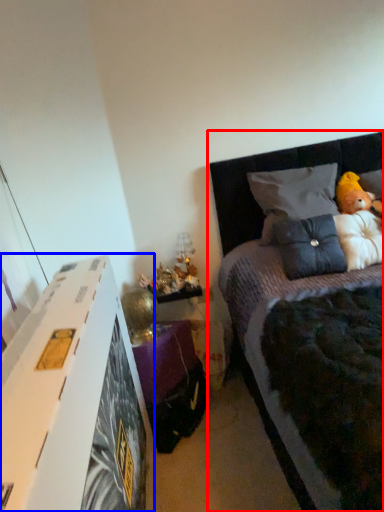
Question: Which object is closer to the camera taking this photo, bed (highlighted by a red box) or nightstand (highlighted by a blue box)?

Choices:
 (A) bed
 (B) nightstand

Answer: (A)